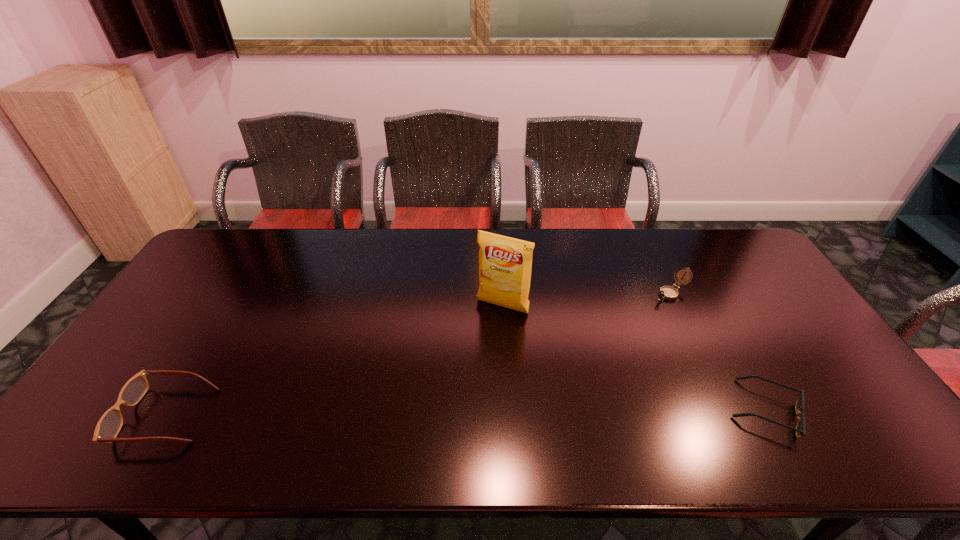
In order to click on free area in between the leftmost object and the shortest object in this screenshot , I will do `click(466, 413)`.

Locate an element on the screen. The image size is (960, 540). free space between the second tallest object and the spectacles is located at coordinates (419, 354).

Where is `blank region between the second object from left to right and the shortest object`? This screenshot has height=540, width=960. blank region between the second object from left to right and the shortest object is located at coordinates (634, 358).

Locate an element on the screen. The width and height of the screenshot is (960, 540). empty space between the third shortest object and the sunglasses is located at coordinates (718, 351).

This screenshot has width=960, height=540. I want to click on object that is the closest one to the tallest object, so click(666, 292).

Identify which object is the third closest to the sunglasses. Please provide its 2D coordinates. Your answer should be formatted as a tuple, i.e. [(x, y)], where the tuple contains the x and y coordinates of a point satisfying the conditions above.

[(109, 425)]

Identify the location of vacant point that satisfies the following two spatial constraints: 1. on the front side of the crisp (potato chip); 2. on the lenses of the shortest object. This screenshot has width=960, height=540. (508, 410).

Locate an element on the screen. The image size is (960, 540). vacant space that satisfies the following two spatial constraints: 1. on the front side of the sunglasses; 2. on the lenses of the second tallest object is located at coordinates (727, 410).

Identify the location of free space that satisfies the following two spatial constraints: 1. on the front side of the shortest object; 2. on the lenses of the second tallest object. (727, 410).

The width and height of the screenshot is (960, 540). In order to click on free location that satisfies the following two spatial constraints: 1. on the front side of the compass; 2. on the lenses of the sunglasses in this screenshot , I will do [727, 410].